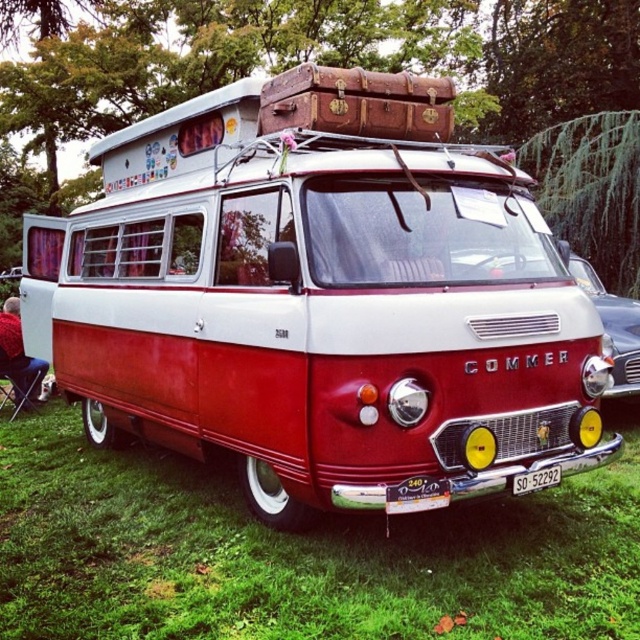
You are setting up a picnic area and need to place a picnic blanket between the matte red van at center and the red fabric chair at lower left. Given their widths, which object requires more space along the ground for placement?

The matte red van at center requires more space along the ground for placement because its width surpasses that of the red fabric chair at lower left.

You are standing next to a camera that is 1.5 meters tall. You want to take a photo of the matte red van at center. Can you see the entire van in the photo without moving the camera?

The matte red van at center and camera are 3.18 meters apart. Since the camera is 1.5 meters tall, the distance allows the camera to capture the entire van as long as the camera angle is adjusted properly. However, the height of the camera might affect the framing. To ensure the entire van is visible, you might need to position the camera lower or use a wide angle lens.